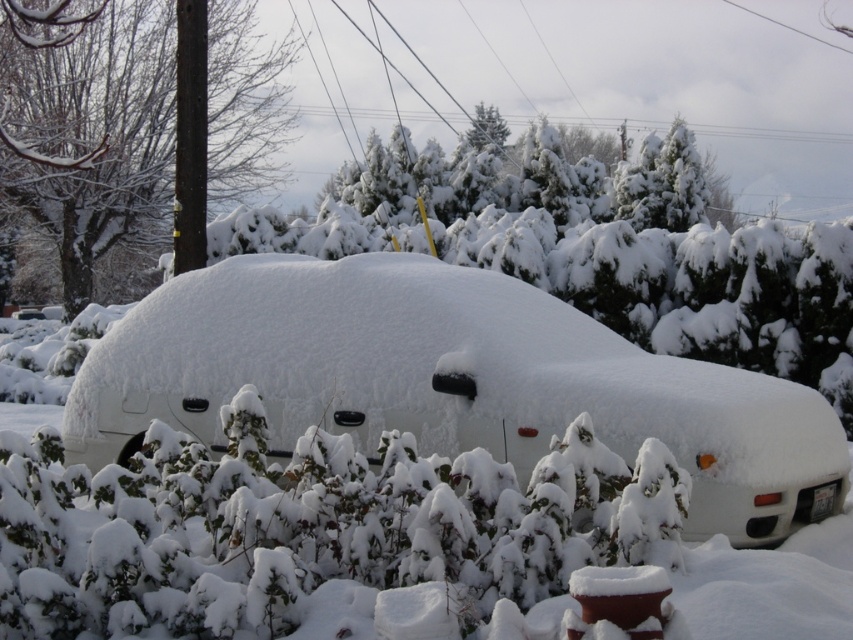
Question: Which of the following is the closest to the observer?

Choices:
 (A) (76, 401)
 (B) (86, 140)

Answer: (A)

Question: Is white matte car at center positioned at the back of white fluffy bush at lower center?

Choices:
 (A) no
 (B) yes

Answer: (B)

Question: Does white matte car at center appear on the right side of white fluffy bush at lower center?

Choices:
 (A) yes
 (B) no

Answer: (A)

Question: Can you confirm if white fluffy bush at lower center is smaller than snow-covered shrub at left?

Choices:
 (A) yes
 (B) no

Answer: (B)

Question: Which object is positioned closest to the snow-covered shrub at left?

Choices:
 (A) white matte car at center
 (B) white fluffy bush at lower center

Answer: (A)

Question: Which is nearer to the white matte car at center?

Choices:
 (A) snow-covered shrub at left
 (B) white fluffy bush at lower center

Answer: (B)